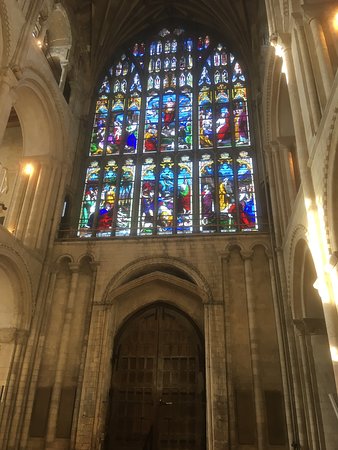
You are a GUI agent. You are given a task and a screenshot of the screen. Output one action in this format:
    pyautogui.click(x=<x>, y=<y>)
    Task: Click on the door
    The height and width of the screenshot is (450, 338).
    Given the screenshot: What is the action you would take?
    pyautogui.click(x=136, y=339)